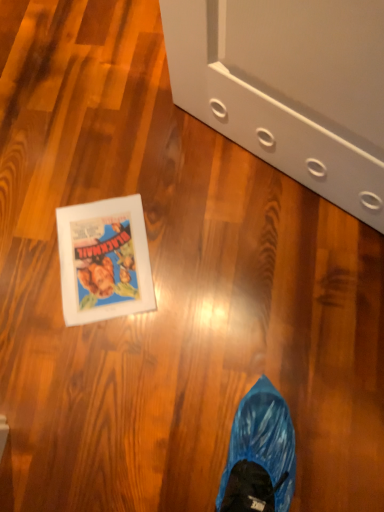
The image size is (384, 512). In order to click on free region under matte paper comic book at lower left (from a real-world perspective) in this screenshot , I will do `click(107, 261)`.